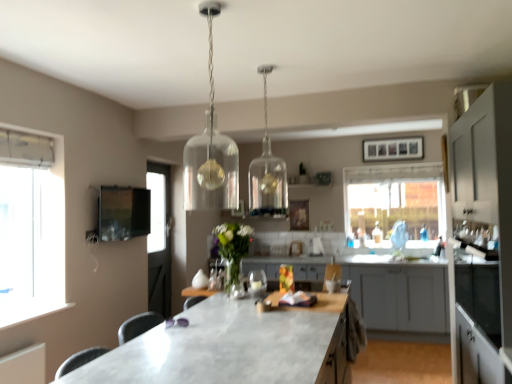
Question: From a real-world perspective, is white matte cabinet at right, placed as the 2th cabinetry when sorted from back to front, physically located above or below translucent glass vase at center?

Choices:
 (A) below
 (B) above

Answer: (A)

Question: Considering their positions, is white matte cabinet at right, the 1th cabinetry when ordered from front to back, located in front of or behind translucent glass vase at center?

Choices:
 (A) behind
 (B) front

Answer: (B)

Question: Estimate the real-world distances between objects in this image. Which object is farther from the clear glass pendant light at upper center, the second lamp when ordered from back to front?

Choices:
 (A) translucent glass vase at center
 (B) white matte cabinet at right, the 1th cabinetry when ordered from front to back
 (C) clear glass pendant light at upper center, which is the 1th lamp from right to left
 (D) matte black tv at upper left
 (E) transparent glass window at center

Answer: (E)

Question: Considering the real-world distances, which object is closest to the matte gray cabinets at center, placed as the first cabinetry when sorted from back to front?

Choices:
 (A) matte black tv at upper left
 (B) transparent glass window at center
 (C) white matte cabinet at right, placed as the 2th cabinetry when sorted from back to front
 (D) white marble countertop at center
 (E) clear glass wine glass at center

Answer: (B)